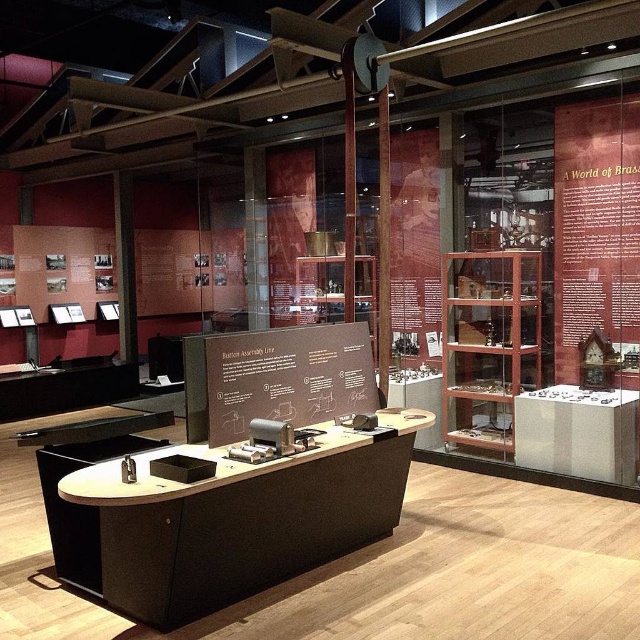
Question: Does brown paper at upper right appear on the left side of brown matte signboard at center?

Choices:
 (A) no
 (B) yes

Answer: (A)

Question: Can you confirm if brown paper at upper right is positioned above brown matte signboard at center?

Choices:
 (A) yes
 (B) no

Answer: (A)

Question: In this image, where is brown paper at upper right located relative to brown matte signboard at center?

Choices:
 (A) right
 (B) left

Answer: (A)

Question: Which of the following is the closest to the observer?

Choices:
 (A) brown matte signboard at center
 (B) brown paper at upper right

Answer: (A)